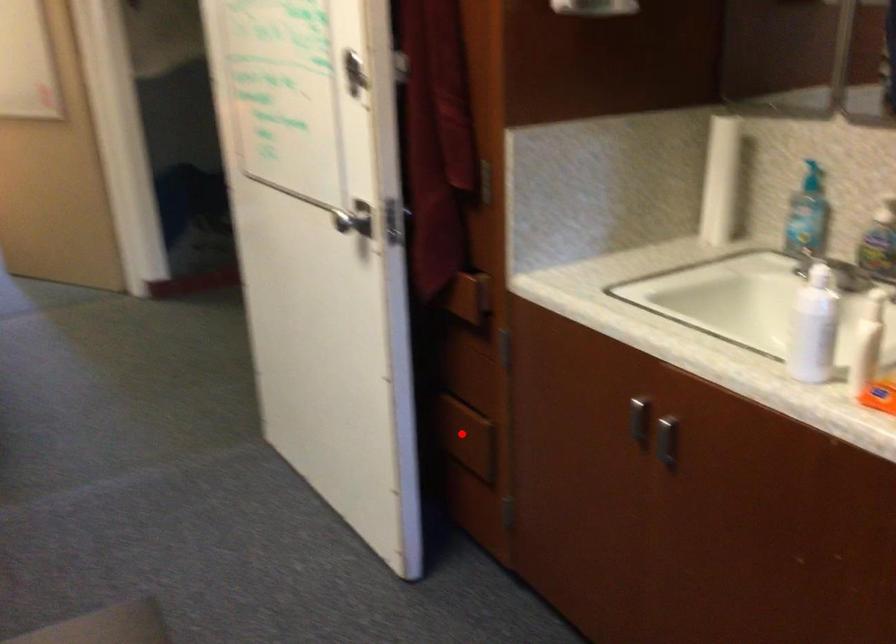
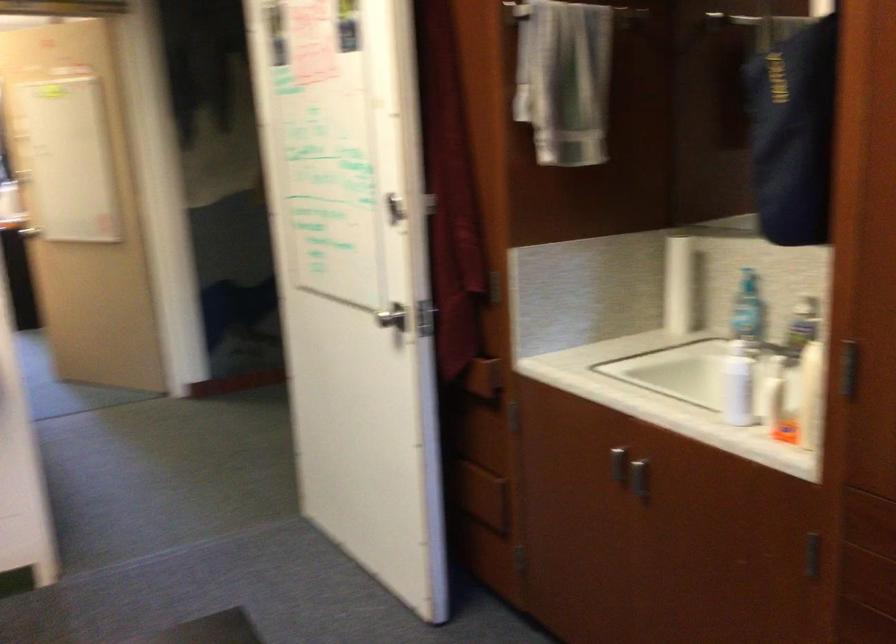
Question: I am providing you with two images of the same scene from different viewpoints. In image1, a red point is highlighted. Considering the same 3D point in image2, which of the following is correct?

Choices:
 (A) It is closer
 (B) It is farther

Answer: (B)